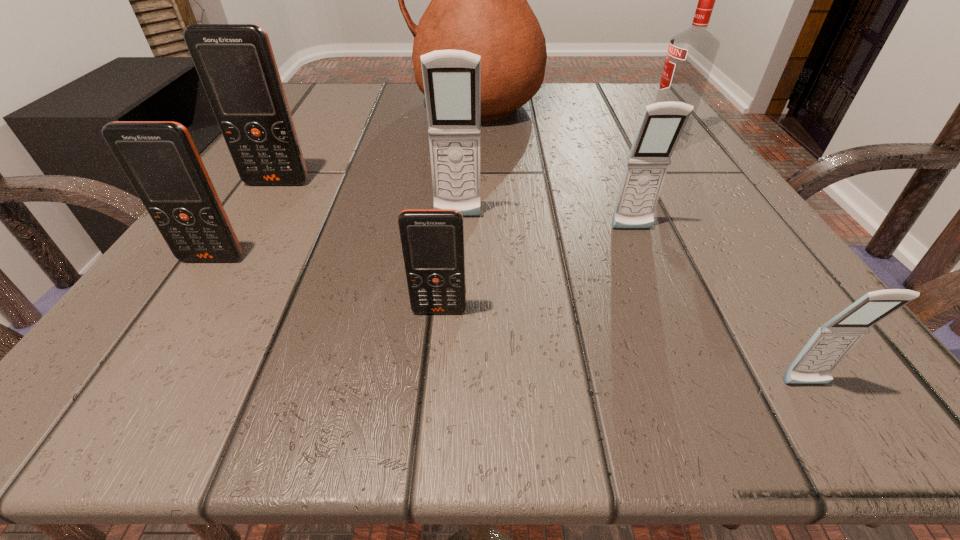
Locate an element on the screen. free space between the leftmost gray cellular telephone and the farthest cellular telephone is located at coordinates (368, 200).

Locate an element on the screen. The image size is (960, 540). unoccupied position between the vodka and the nearest cellular telephone is located at coordinates (735, 264).

Identify which object is the fifth closest to the farthest orange cellular telephone. Please provide its 2D coordinates. Your answer should be formatted as a tuple, i.e. [(x, y)], where the tuple contains the x and y coordinates of a point satisfying the conditions above.

[(662, 123)]

Locate which object is the seventh closest to the biggest orange cellular telephone. Please provide its 2D coordinates. Your answer should be formatted as a tuple, i.e. [(x, y)], where the tuple contains the x and y coordinates of a point satisfying the conditions above.

[(830, 344)]

The image size is (960, 540). I want to click on cellular telephone that is the second closest to the nearest cellular telephone, so click(432, 240).

Locate which cellular telephone is the second closest to the fifth farthest object. Please provide its 2D coordinates. Your answer should be formatted as a tuple, i.e. [(x, y)], where the tuple contains the x and y coordinates of a point satisfying the conditions above.

[(830, 344)]

Identify which gray cellular telephone is the nearest to the fifth nearest cellular telephone. Please provide its 2D coordinates. Your answer should be formatted as a tuple, i.e. [(x, y)], where the tuple contains the x and y coordinates of a point satisfying the conditions above.

[(662, 123)]

Choose which gray cellular telephone is the second nearest neighbor to the tallest object. Please provide its 2D coordinates. Your answer should be formatted as a tuple, i.e. [(x, y)], where the tuple contains the x and y coordinates of a point satisfying the conditions above.

[(662, 123)]

Where is `orange cellular telephone object that ranks as the second closest to the farthest orange cellular telephone`? The image size is (960, 540). orange cellular telephone object that ranks as the second closest to the farthest orange cellular telephone is located at coordinates (432, 240).

Select which orange cellular telephone appears as the second closest to the third nearest object. Please provide its 2D coordinates. Your answer should be formatted as a tuple, i.e. [(x, y)], where the tuple contains the x and y coordinates of a point satisfying the conditions above.

[(432, 240)]